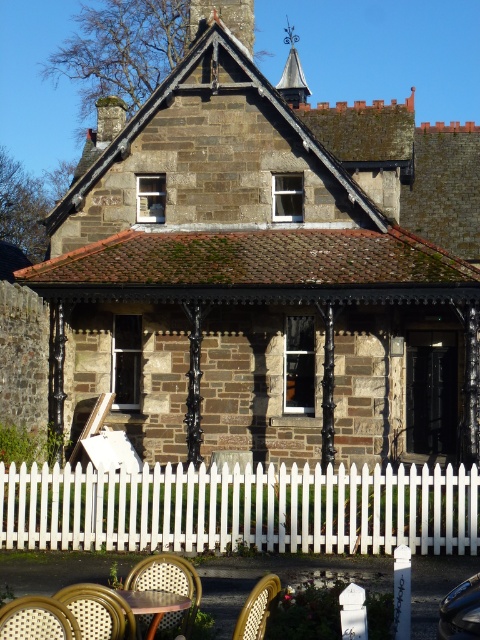
Describe the element at coordinates (36, 620) in the screenshot. I see `rattan chair at lower left` at that location.

Between rattan chair at lower left and wooden woven chair at lower center, which one appears on the left side from the viewer's perspective?

Positioned to the left is rattan chair at lower left.

Which is in front, point (36, 620) or point (235, 628)?

Point (36, 620)

What are the coordinates of `rattan chair at lower left` in the screenshot? It's located at (36, 620).

Between wooden woven chair at lower left and rattan chair at lower left, which one has more height?

wooden woven chair at lower left is taller.

Between wooden woven chair at lower left and rattan chair at lower left, which one has less height?

With less height is rattan chair at lower left.

Between point (110, 621) and point (48, 600), which one is positioned behind?

The point (110, 621) is more distant.

The image size is (480, 640). Find the location of `wooden woven chair at lower left`. wooden woven chair at lower left is located at coordinates (97, 611).

Between wooden woven chair at lower left and rattan chair at lower center, which one is positioned lower?

rattan chair at lower center is lower down.

Between wooden woven chair at lower left and rattan chair at lower center, which one is positioned higher?

wooden woven chair at lower left is higher up.

The height and width of the screenshot is (640, 480). In order to click on wooden woven chair at lower left in this screenshot , I will do `click(97, 611)`.